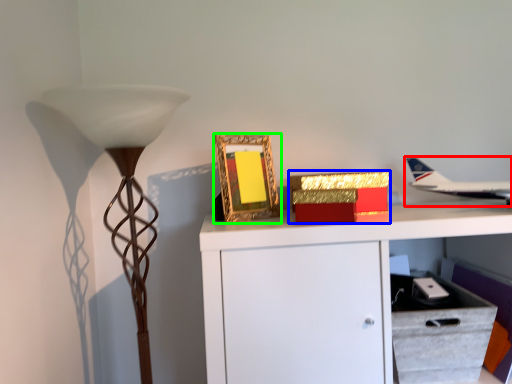
Question: Which object is the farthest from airplane (highlighted by a red box)? Choose among these: box (highlighted by a blue box) or picture frame (highlighted by a green box).

Choices:
 (A) box
 (B) picture frame

Answer: (B)